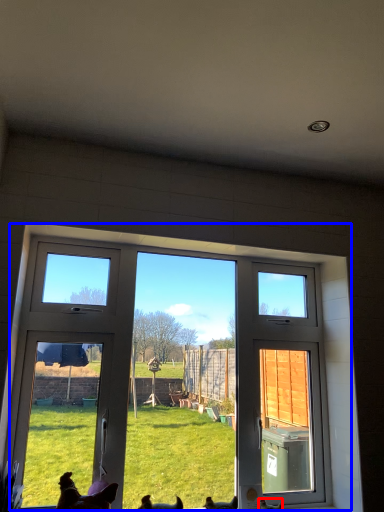
Question: Which of the following is the farthest to the observer, chicken (highlighted by a red box) or window (highlighted by a blue box)?

Choices:
 (A) chicken
 (B) window

Answer: (A)